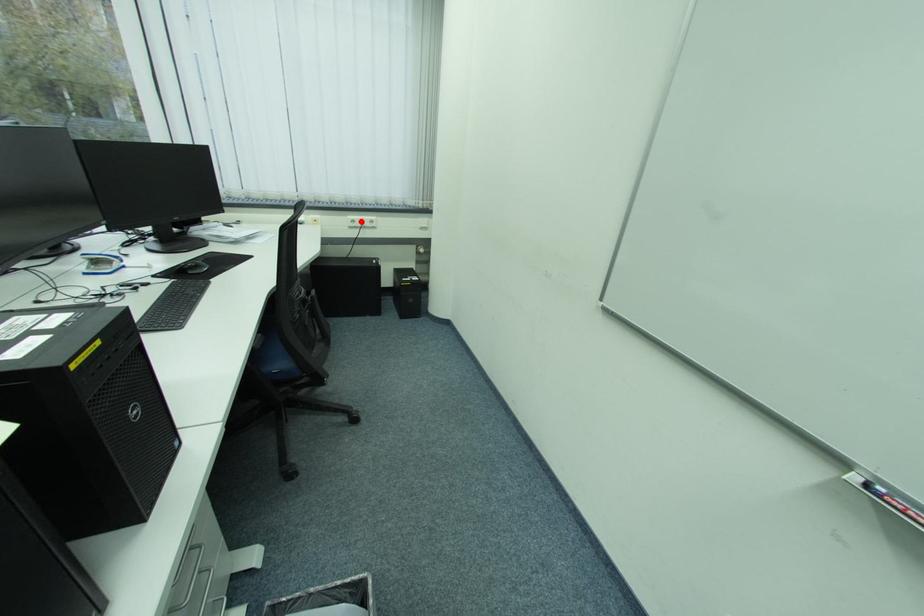
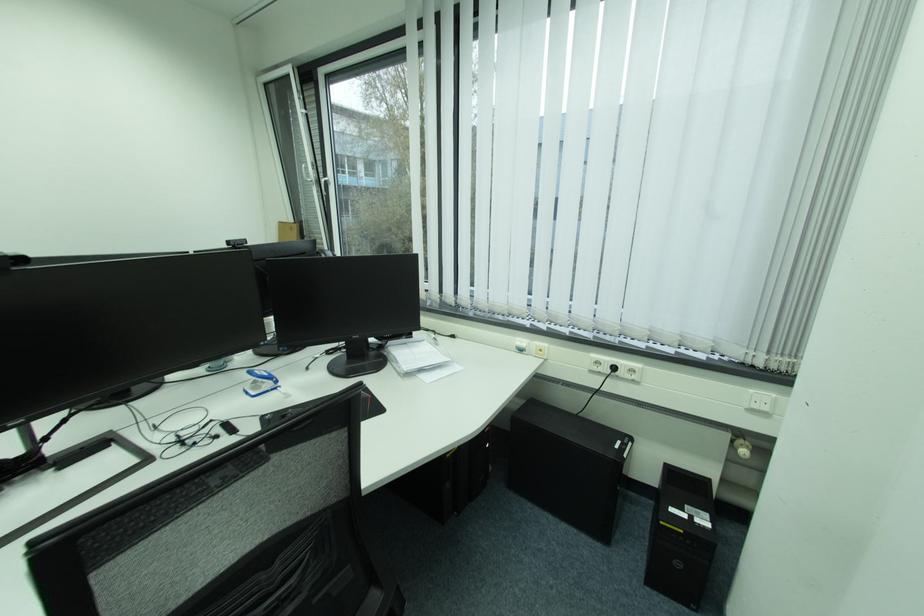
Question: I am providing you with two images of the same scene from different viewpoints. In image1, a red point is highlighted. Considering the same 3D point in image2, which of the following is correct?

Choices:
 (A) It is closer
 (B) It is farther

Answer: (B)